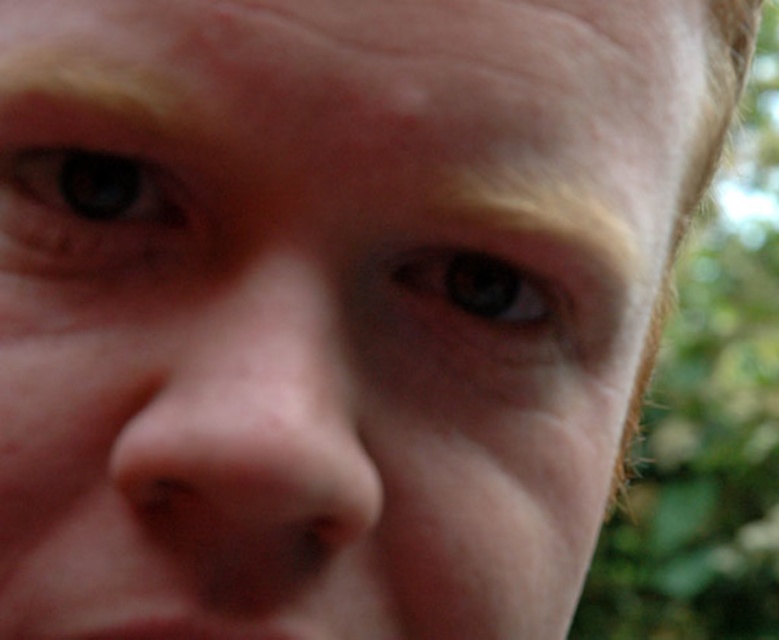
Question: Is blue matte eye at upper left below brown matte eye at center?

Choices:
 (A) no
 (B) yes

Answer: (A)

Question: Does blue matte eye at upper left appear on the left side of brown matte eye at center?

Choices:
 (A) yes
 (B) no

Answer: (A)

Question: Which of the following is the closest to the observer?

Choices:
 (A) (217, 460)
 (B) (87, 228)

Answer: (A)

Question: Which point is closer to the camera taking this photo?

Choices:
 (A) (494, 308)
 (B) (20, 192)
 (C) (294, 536)

Answer: (C)

Question: Which object is farther from the camera taking this photo?

Choices:
 (A) brown matte eye at center
 (B) blue matte eye at upper left

Answer: (A)

Question: Can you confirm if smooth skin nose at center is positioned below brown matte eye at center?

Choices:
 (A) no
 (B) yes

Answer: (B)